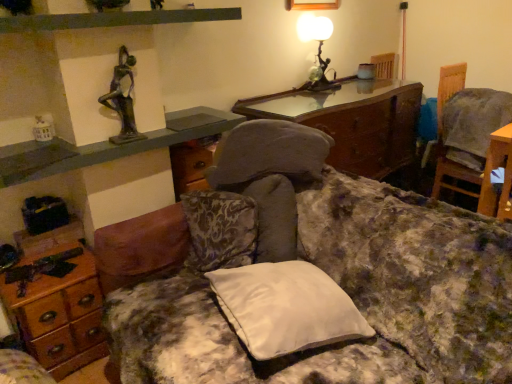
This screenshot has width=512, height=384. In order to click on free space above wooden desk at lower left (from a real-world perspective) in this screenshot , I will do `click(58, 265)`.